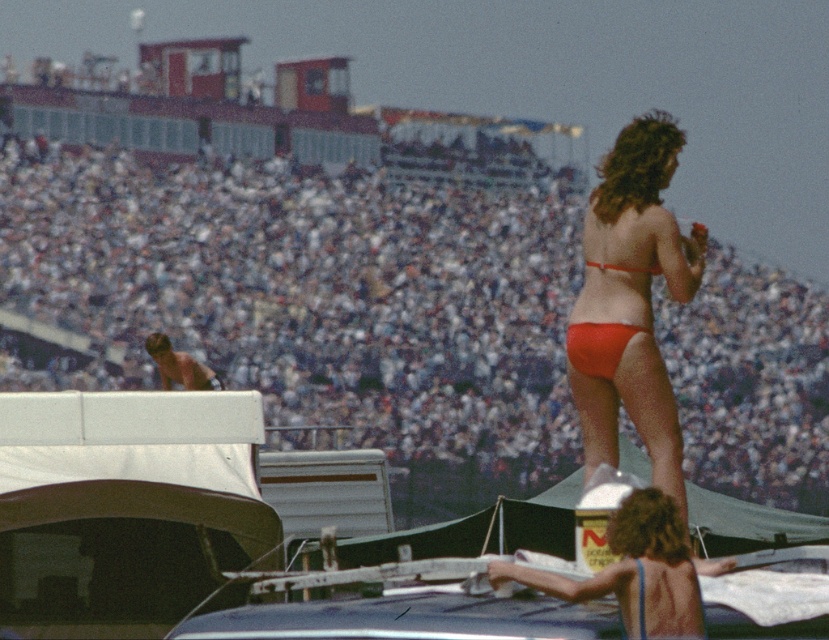
You are a photographer trying to capture a photo of both the orange matte bikini bottom at upper right and the matte red bikini bottom at center. Given that your camera has a maximum focus range of 1.5 meters, will you be able to fit both subjects into the frame without moving closer?

The distance between the orange matte bikini bottom at upper right and the matte red bikini bottom at center is 1.27 meters, which is within the camera maximum focus range of 1.5 meters. Therefore, you can fit both subjects into the frame without moving closer.

You are a photographer at the concert and want to capture a clear shot of both the orange matte bikini bottom at upper right and the matte orange bikini top at upper right. However, you notice one is blocking the other. Which one is in front and might be obscuring the other?

The orange matte bikini bottom at upper right is in front of the matte orange bikini top at upper right, so it might be obscuring the other.

You are a photographer at the music festival. You need to position your camera so that both the matte red bikini bottom at center and the matte orange bikini top at upper right are visible in the frame. Based on their positions, which object should be placed on the left side of the camera frame to ensure both are captured?

The matte red bikini bottom at center should be placed on the left side of the camera frame because it is to the left of the matte orange bikini top at upper right, ensuring both are visible.